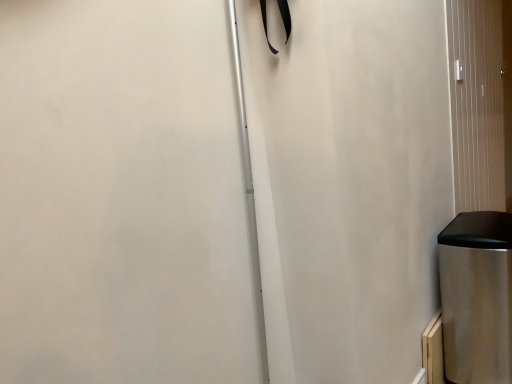
The height and width of the screenshot is (384, 512). Describe the element at coordinates (476, 103) in the screenshot. I see `metallic silver screen door at right` at that location.

I want to click on metallic silver screen door at right, so click(x=476, y=103).

Measure the distance between stainless steel trash can at lower right and camera.

stainless steel trash can at lower right and camera are 1.47 meters apart from each other.

The height and width of the screenshot is (384, 512). I want to click on stainless steel trash can at lower right, so click(477, 297).

The width and height of the screenshot is (512, 384). What do you see at coordinates (477, 297) in the screenshot?
I see `stainless steel trash can at lower right` at bounding box center [477, 297].

Where is `metallic silver screen door at right`? Image resolution: width=512 pixels, height=384 pixels. metallic silver screen door at right is located at coordinates [476, 103].

Is metallic silver screen door at right to the left of stainless steel trash can at lower right from the viewer's perspective?

In fact, metallic silver screen door at right is to the right of stainless steel trash can at lower right.

Consider the image. Considering their positions, is metallic silver screen door at right located in front of or behind stainless steel trash can at lower right?

metallic silver screen door at right is behind stainless steel trash can at lower right.

Is point (463, 162) farther from camera compared to point (462, 293)?

That is True.

From the image's perspective, is metallic silver screen door at right located beneath stainless steel trash can at lower right?

Incorrect, from the image's perspective, metallic silver screen door at right is higher than stainless steel trash can at lower right.

In the scene shown: From a real-world perspective, is metallic silver screen door at right over stainless steel trash can at lower right?

Correct, in the physical world, metallic silver screen door at right is higher than stainless steel trash can at lower right.

Considering the relative sizes of metallic silver screen door at right and stainless steel trash can at lower right in the image provided, is metallic silver screen door at right wider than stainless steel trash can at lower right?

In fact, metallic silver screen door at right might be narrower than stainless steel trash can at lower right.

Is metallic silver screen door at right taller than stainless steel trash can at lower right?

Yes, metallic silver screen door at right is taller than stainless steel trash can at lower right.

Who is smaller, metallic silver screen door at right or stainless steel trash can at lower right?

stainless steel trash can at lower right.

Is metallic silver screen door at right outside of stainless steel trash can at lower right?

Yes, metallic silver screen door at right is located beyond the bounds of stainless steel trash can at lower right.

Would you consider metallic silver screen door at right to be distant from stainless steel trash can at lower right?

They are positioned close to each other.

Could you tell me if metallic silver screen door at right is facing stainless steel trash can at lower right?

No, metallic silver screen door at right is not turned towards stainless steel trash can at lower right.

How many degrees apart are the facing directions of metallic silver screen door at right and stainless steel trash can at lower right?

0.455 degrees separate the facing orientations of metallic silver screen door at right and stainless steel trash can at lower right.

At what (x,y) coordinates should I click in order to perform the action: click on screen door above the stainless steel trash can at lower right (from a real-world perspective). Please return your answer as a coordinate pair (x, y). Image resolution: width=512 pixels, height=384 pixels. Looking at the image, I should click on pyautogui.click(x=476, y=103).

Is stainless steel trash can at lower right to the left of metallic silver screen door at right from the viewer's perspective?

Indeed, stainless steel trash can at lower right is positioned on the left side of metallic silver screen door at right.

Is the position of stainless steel trash can at lower right less distant than that of metallic silver screen door at right?

Yes, stainless steel trash can at lower right is closer to the viewer.

Between point (450, 263) and point (480, 26), which one is positioned behind?

Point (480, 26)

From the image's perspective, which is above, stainless steel trash can at lower right or metallic silver screen door at right?

metallic silver screen door at right appears higher in the image.

From a real-world perspective, which object rests below the other?

In real-world perspective, stainless steel trash can at lower right is lower.

Considering the sizes of stainless steel trash can at lower right and metallic silver screen door at right in the image, is stainless steel trash can at lower right wider or thinner than metallic silver screen door at right?

In the image, stainless steel trash can at lower right appears to be wider than metallic silver screen door at right.

Considering the relative sizes of stainless steel trash can at lower right and metallic silver screen door at right in the image provided, is stainless steel trash can at lower right taller than metallic silver screen door at right?

In fact, stainless steel trash can at lower right may be shorter than metallic silver screen door at right.

Who is bigger, stainless steel trash can at lower right or metallic silver screen door at right?

Bigger between the two is metallic silver screen door at right.

Is stainless steel trash can at lower right inside the boundaries of metallic silver screen door at right, or outside?

stainless steel trash can at lower right is located beyond the bounds of metallic silver screen door at right.

Would you consider stainless steel trash can at lower right to be distant from metallic silver screen door at right?

That's not correct — stainless steel trash can at lower right is a little close to metallic silver screen door at right.

Is metallic silver screen door at right at the back of stainless steel trash can at lower right?

No.

How many degrees apart are the facing directions of stainless steel trash can at lower right and metallic silver screen door at right?

The facing directions of stainless steel trash can at lower right and metallic silver screen door at right are 0.455 degrees apart.

Identify the location of waste container located below the metallic silver screen door at right (from the image's perspective). (477, 297).

You are a GUI agent. You are given a task and a screenshot of the screen. Output one action in this format:
    pyautogui.click(x=<x>, y=<y>)
    Task: Click on the waste container on the left of metallic silver screen door at right
    This screenshot has width=512, height=384.
    Given the screenshot: What is the action you would take?
    pyautogui.click(x=477, y=297)

Image resolution: width=512 pixels, height=384 pixels. Find the location of `screen door above the stainless steel trash can at lower right (from a real-world perspective)`. screen door above the stainless steel trash can at lower right (from a real-world perspective) is located at coordinates (476, 103).